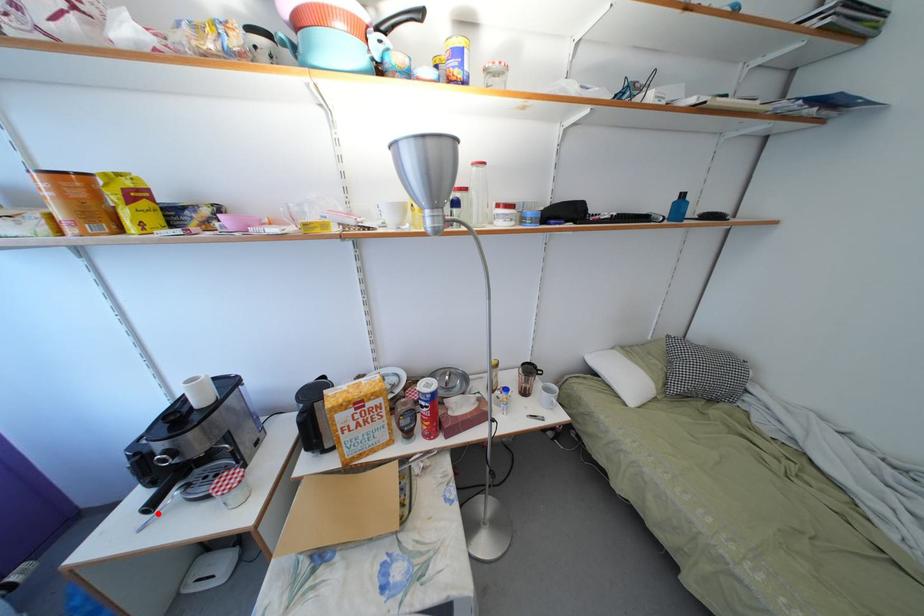
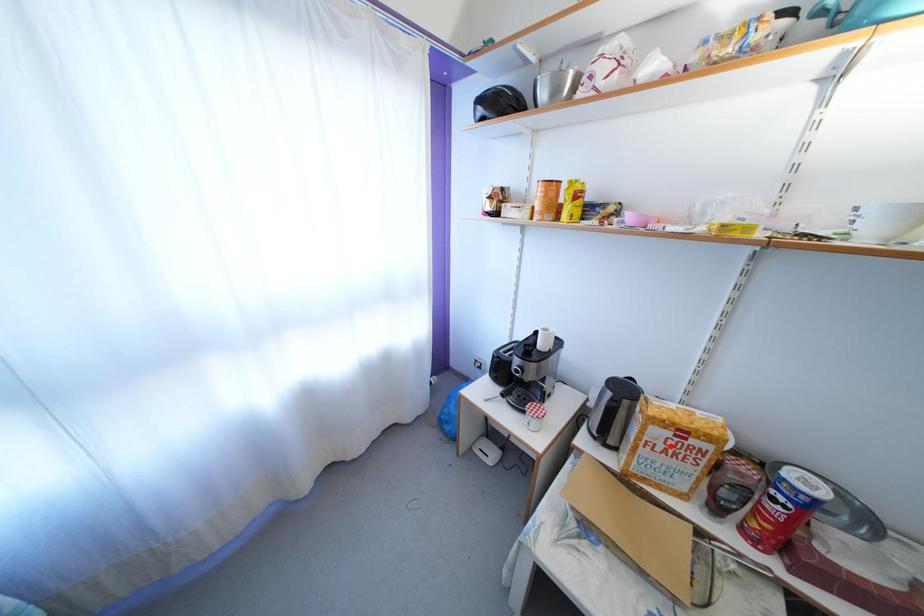
I am providing you with two images of the same scene from different viewpoints. A red point is marked on the first image and another point is marked on the second image. Is the red point in image1 aligned with the point shown in image2?

No